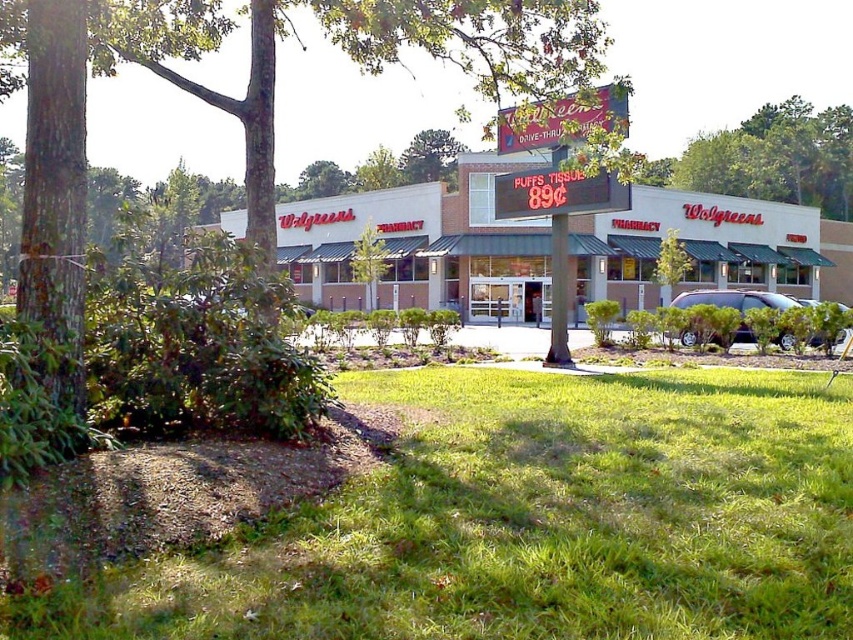
Between green leafy tree at center and white matte building at center, which one has less height?

With less height is white matte building at center.

Measure the distance from green leafy tree at center to white matte building at center.

green leafy tree at center is 23.58 meters away from white matte building at center.

Does point (335, 44) lie behind point (740, 241)?

Yes, point (335, 44) is behind point (740, 241).

Find the location of a particular element. green leafy tree at center is located at coordinates (239, 99).

Can you confirm if green grass at lower center is wider than green leafy tree at center?

In fact, green grass at lower center might be narrower than green leafy tree at center.

Measure the distance between point (791, 500) and camera.

A distance of 16.36 feet exists between point (791, 500) and camera.

Locate an element on the screen. The width and height of the screenshot is (853, 640). green grass at lower center is located at coordinates (531, 522).

Who is more forward, (x=73, y=390) or (x=589, y=125)?

Point (x=73, y=390) is in front.

Who is more forward, (76,259) or (616,102)?

Positioned in front is point (76,259).

At what (x,y) coordinates should I click in order to perform the action: click on green leafy tree at center. Please return your answer as a coordinate pair (x, y). This screenshot has height=640, width=853. Looking at the image, I should click on 239,99.